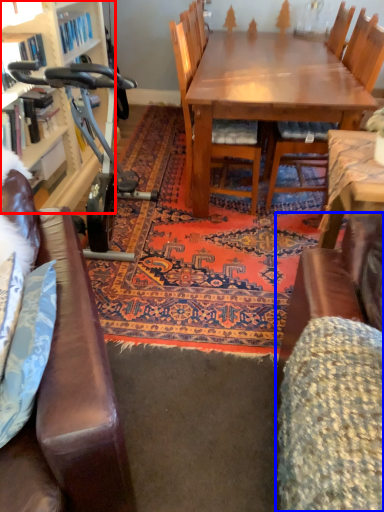
Question: Which object is closer to the camera taking this photo, bookcase (highlighted by a red box) or swivel chair (highlighted by a blue box)?

Choices:
 (A) bookcase
 (B) swivel chair

Answer: (B)